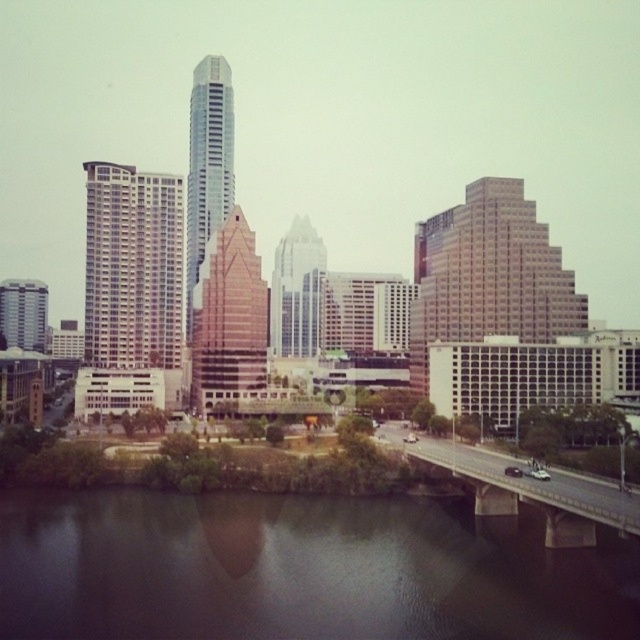
Question: Does brown textured building at center have a smaller size compared to matte gray building at left?

Choices:
 (A) no
 (B) yes

Answer: (A)

Question: Which point is farther from the camera taking this photo?

Choices:
 (A) (563, 321)
 (B) (84, 320)
 (C) (22, 284)

Answer: (C)

Question: Does dark reflective water at lower center have a larger size compared to beige textured building at center?

Choices:
 (A) yes
 (B) no

Answer: (B)

Question: Where is beige textured building at center located in relation to glassy reflective skyscraper at center in the image?

Choices:
 (A) left
 (B) right

Answer: (B)

Question: Which point is farther from the camera taking this photo?

Choices:
 (A) (252, 316)
 (B) (451, 211)
 (C) (45, 321)
 (D) (396, 602)

Answer: (C)

Question: Which point is closer to the camera?

Choices:
 (A) matte gray building at left
 (B) beige textured building at center
 (C) concrete bridge at lower right
 (D) glassy reflective skyscraper at center

Answer: (C)